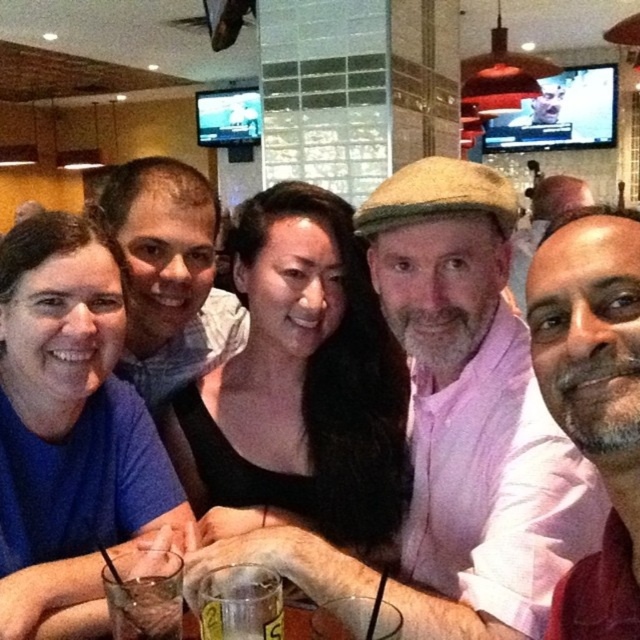
Question: Does black matte shirt at center appear on the right side of gray beard at center?

Choices:
 (A) yes
 (B) no

Answer: (B)

Question: Which point is farther to the camera?

Choices:
 (A) (388, 330)
 (B) (618, 310)

Answer: (A)

Question: Which point is closer to the camera?

Choices:
 (A) translucent glass at center
 (B) matte gray shirt at center
 (C) blue shirt at left
 (D) pink cotton shirt at center

Answer: (A)

Question: Is pink cotton shirt at center to the left of blue shirt at left from the viewer's perspective?

Choices:
 (A) yes
 (B) no

Answer: (B)

Question: Based on their relative distances, which object is nearer to the pink cotton shirt at center?

Choices:
 (A) translucent glass at center
 (B) blue shirt at left
 (C) clear glass at center
 (D) black matte shirt at center

Answer: (D)

Question: Can you confirm if black matte shirt at center is smaller than gray beard at center?

Choices:
 (A) no
 (B) yes

Answer: (A)